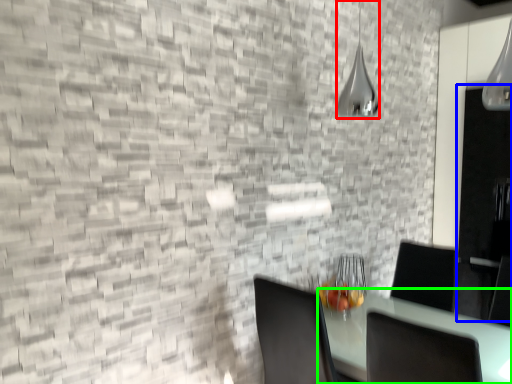
Question: Which object is the farthest from lamp (highlighted by a red box)? Choose among these: glass door (highlighted by a blue box) or table (highlighted by a green box).

Choices:
 (A) glass door
 (B) table

Answer: (B)